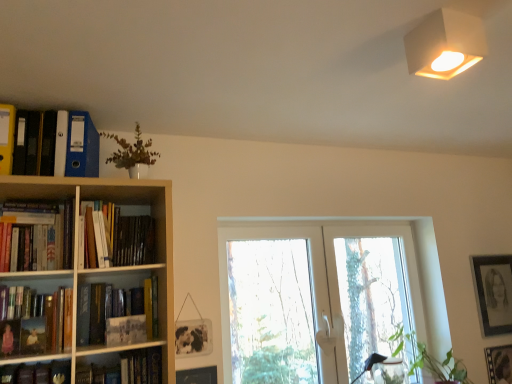
Question: Does white matte lampshade at upper right come in front of hardcover book at lower left, the first book from the bottom?

Choices:
 (A) no
 (B) yes

Answer: (B)

Question: Is hardcover book at lower left, which is the 4th book in top-to-bottom order, inside white matte lampshade at upper right?

Choices:
 (A) yes
 (B) no

Answer: (B)

Question: From the image's perspective, is white matte lampshade at upper right on top of hardcover book at lower left, the first book from the bottom?

Choices:
 (A) yes
 (B) no

Answer: (A)

Question: Is the surface of white matte lampshade at upper right in direct contact with hardcover book at lower left, which is the 4th book in top-to-bottom order?

Choices:
 (A) no
 (B) yes

Answer: (A)

Question: Is white matte lampshade at upper right shorter than hardcover book at lower left, which is the 4th book in top-to-bottom order?

Choices:
 (A) yes
 (B) no

Answer: (A)

Question: Is white matte lampshade at upper right bigger or smaller than transparent glass door at center?

Choices:
 (A) big
 (B) small

Answer: (B)

Question: From their relative heights in the image, would you say white matte lampshade at upper right is taller or shorter than transparent glass door at center?

Choices:
 (A) tall
 (B) short

Answer: (B)

Question: Considering the positions of white matte lampshade at upper right and transparent glass door at center in the image, is white matte lampshade at upper right wider or thinner than transparent glass door at center?

Choices:
 (A) wide
 (B) thin

Answer: (B)

Question: Relative to transparent glass door at center, is white matte lampshade at upper right in front or behind?

Choices:
 (A) front
 (B) behind

Answer: (A)

Question: Is matte white vase at upper left, the second plant positioned from the right, spatially inside matte black picture frame at lower right, which is counted as the 2th picture frame, starting from the back, or outside of it?

Choices:
 (A) outside
 (B) inside

Answer: (A)

Question: From a real-world perspective, is matte white vase at upper left, the first plant from the front, physically located above or below matte black picture frame at lower right, the 3th picture frame when ordered from top to bottom?

Choices:
 (A) below
 (B) above

Answer: (B)

Question: In terms of height, does matte white vase at upper left, marked as the 2th plant in a bottom-to-top arrangement, look taller or shorter compared to matte black picture frame at lower right, which ranks as the 2th picture frame in right-to-left order?

Choices:
 (A) tall
 (B) short

Answer: (B)

Question: Based on their sizes in the image, would you say matte white vase at upper left, marked as the 2th plant in a bottom-to-top arrangement, is bigger or smaller than matte black picture frame at lower right, acting as the second picture frame starting from the left?

Choices:
 (A) big
 (B) small

Answer: (A)

Question: In terms of height, does green leafy plant at lower right, positioned as the 1th plant in back-to-front order, look taller or shorter compared to transparent glass door at center?

Choices:
 (A) tall
 (B) short

Answer: (B)

Question: From the image's perspective, is green leafy plant at lower right, which is the second plant in top-to-bottom order, positioned above or below transparent glass door at center?

Choices:
 (A) above
 (B) below

Answer: (B)